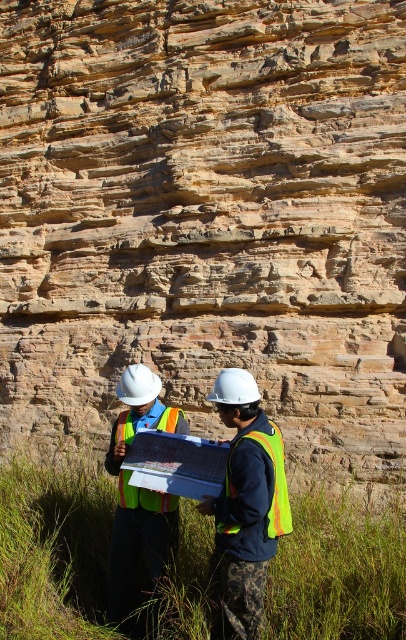
Is reflective yellow vest at center thinner than matte plastic clipboard at center?

Correct, reflective yellow vest at center's width is less than matte plastic clipboard at center's.

Between reflective yellow vest at center and matte plastic clipboard at center, which one has less height?

With less height is reflective yellow vest at center.

Is point (220, 372) farther from viewer compared to point (131, 465)?

Yes, point (220, 372) is farther from viewer.

Identify the location of reflective yellow vest at center. (246, 502).

Is reflective safety vest at center positioned before matte plastic clipboard at center?

No.

Is point (168, 550) closer to camera compared to point (209, 444)?

Yes, point (168, 550) is closer to viewer.

Where is `reflective safety vest at center`? This screenshot has width=406, height=640. reflective safety vest at center is located at coordinates (138, 490).

The width and height of the screenshot is (406, 640). What do you see at coordinates (246, 502) in the screenshot? I see `reflective yellow vest at center` at bounding box center [246, 502].

Is reflective yellow vest at center below reflective yellow safety vest at center?

Actually, reflective yellow vest at center is above reflective yellow safety vest at center.

Which is in front, point (261, 413) or point (118, 429)?

Point (261, 413) is in front.

You are a GUI agent. You are given a task and a screenshot of the screen. Output one action in this format:
    pyautogui.click(x=<x>, y=<y>)
    Task: Click on the reflective yellow vest at center
    
    Given the screenshot: What is the action you would take?
    pyautogui.click(x=246, y=502)